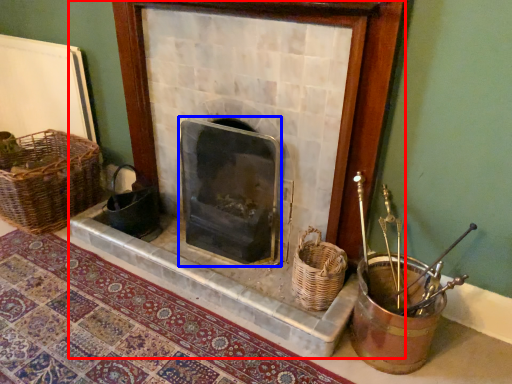
Question: Among these objects, which one is nearest to the camera, fireplace (highlighted by a red box) or wood burning stove (highlighted by a blue box)?

Choices:
 (A) fireplace
 (B) wood burning stove

Answer: (A)